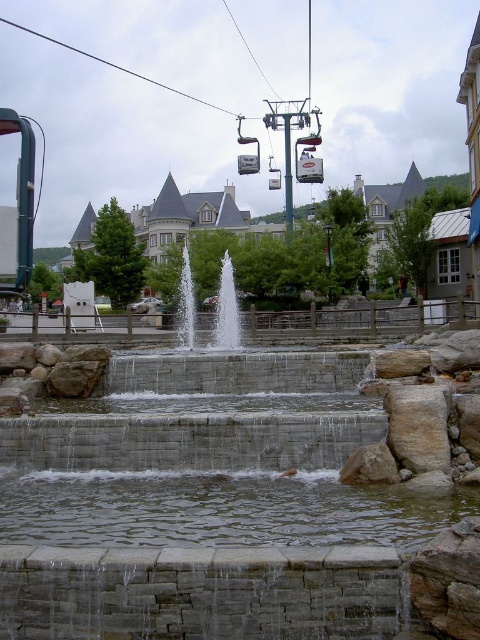
Looking at this image, you are a photographer planning to capture the entire structure of both the clear glass waterfall at center and the metallic cable car at center in one shot. Considering their sizes, which object should you focus on first to ensure both fit in the frame?

The clear glass waterfall at center is bigger than the metallic cable car at center, so you should focus on the clear glass waterfall at center first to ensure both fit in the frame.

From the picture: You are standing in front of the fountain and want to take a photo of both the clear water at center and the metallic cable car at center. Which object will appear smaller in the photo?

The clear water at center will appear smaller in the photo because it is shorter than the metallic cable car at center.

You are standing in the outdoor scene and want to take a photo of the clear glass waterfall at center and the metallic cable car at center. Since both are in the center, how can you position yourself to capture both in the frame?

The clear glass waterfall at center is located above the metallic cable car at center, so you can position yourself below the waterfall to include both in your photo by looking upwards.